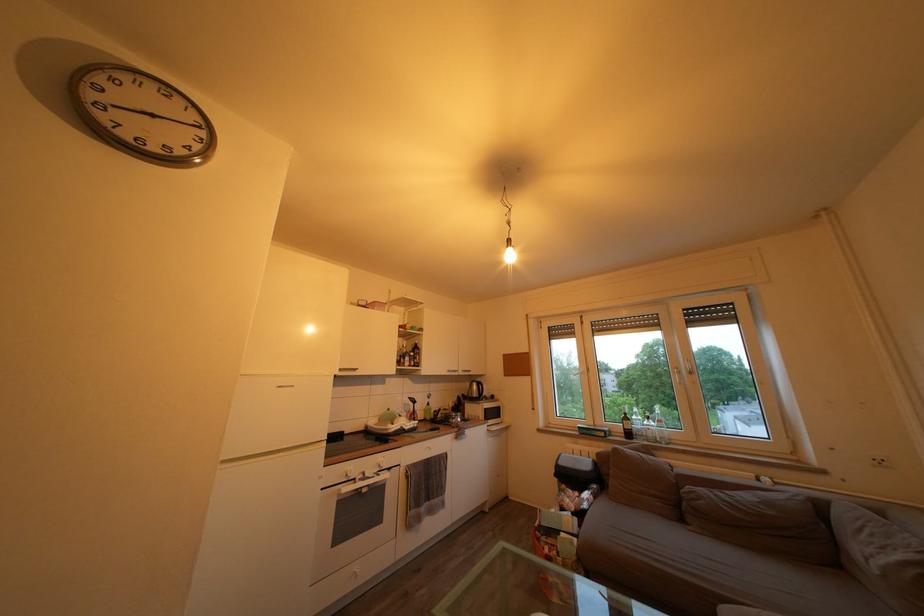
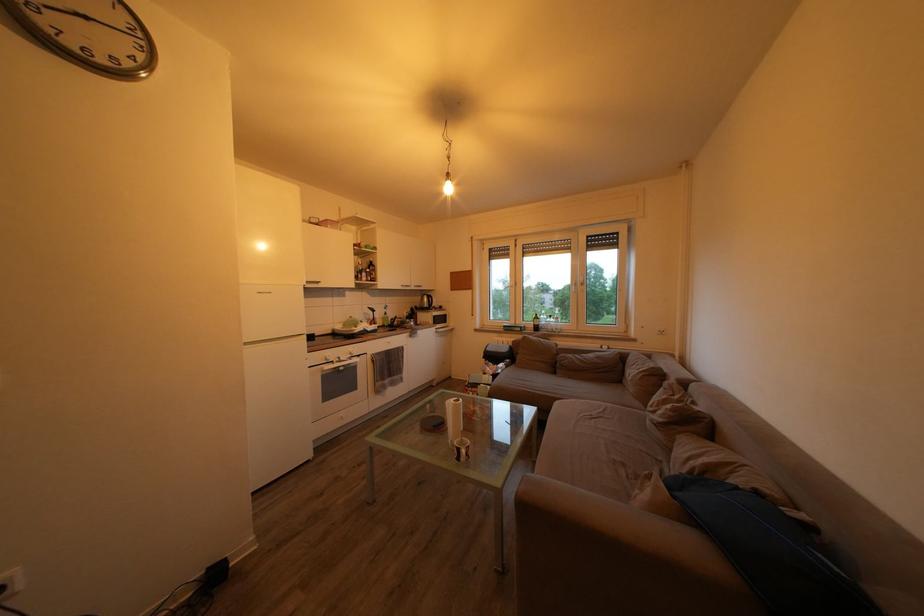
The point at (691, 371) is marked in the first image. Where is the corresponding point in the second image?

(588, 286)